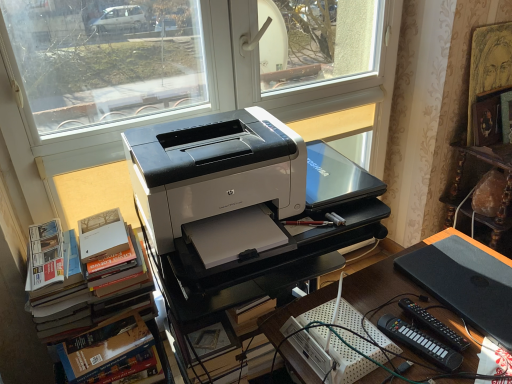
At what (x,y) coordinates should I click in order to perform the action: click on vacant space situated above black plastic desk at center (from a real-world perspective). Please return your answer as a coordinate pair (x, y). The height and width of the screenshot is (384, 512). Looking at the image, I should click on (431, 307).